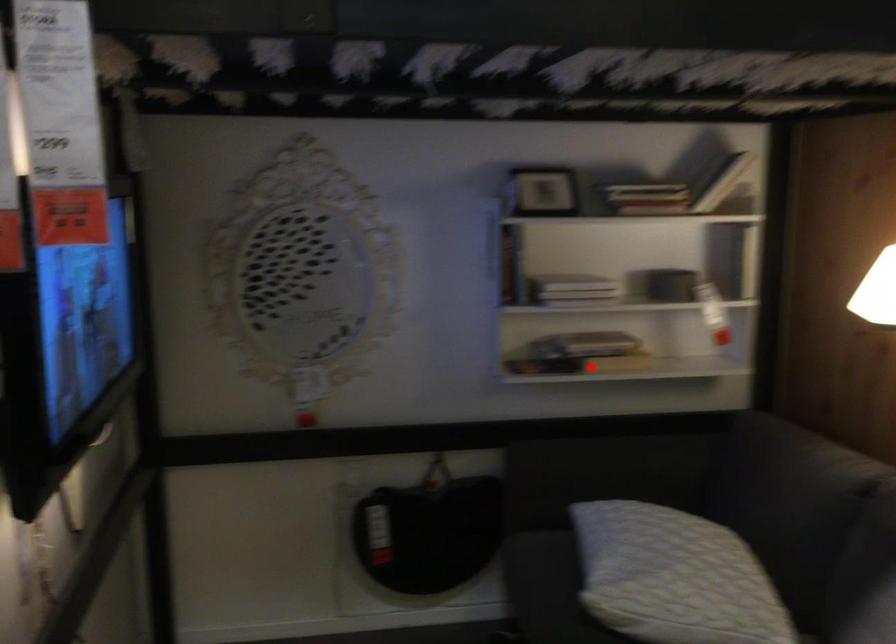
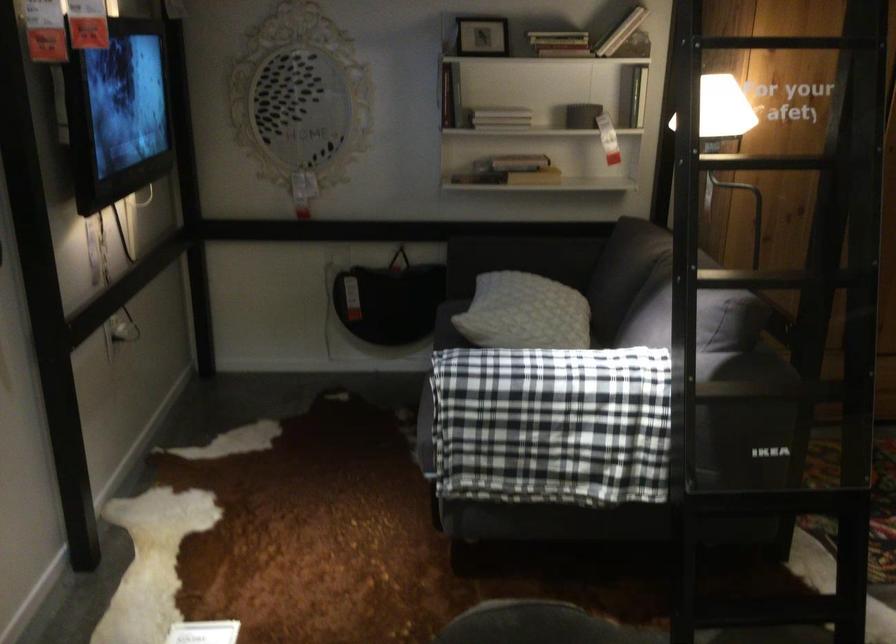
In the second image, find the point that corresponds to the highlighted location in the first image.

(509, 171)